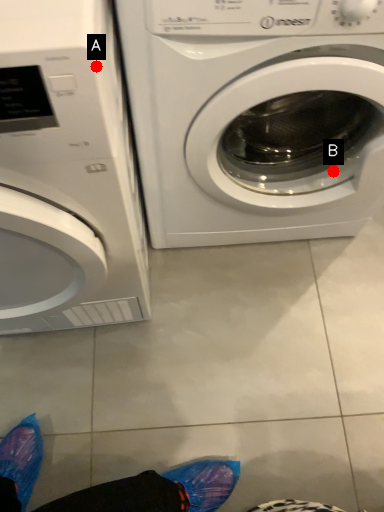
Question: Two points are circled on the image, labeled by A and B beside each circle. Which point appears closest to the camera in this image?

Choices:
 (A) A is closer
 (B) B is closer

Answer: (A)